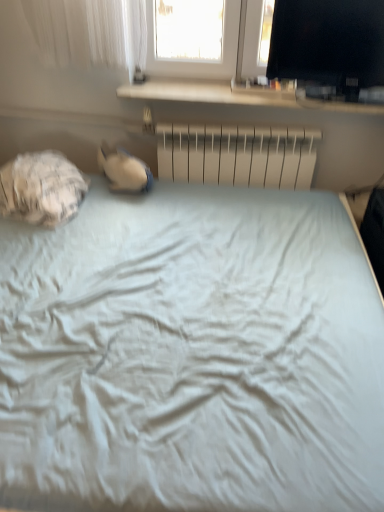
Question: Is black glossy monitor at upper right at the back of white textured sleeping bag at left?

Choices:
 (A) yes
 (B) no

Answer: (B)

Question: Does white textured sleeping bag at left have a greater height compared to black glossy monitor at upper right?

Choices:
 (A) yes
 (B) no

Answer: (B)

Question: From the image's perspective, is white textured sleeping bag at left beneath black glossy monitor at upper right?

Choices:
 (A) yes
 (B) no

Answer: (A)

Question: Does white textured sleeping bag at left have a smaller size compared to black glossy monitor at upper right?

Choices:
 (A) yes
 (B) no

Answer: (B)

Question: Is white textured sleeping bag at left to the right of black glossy monitor at upper right from the viewer's perspective?

Choices:
 (A) yes
 (B) no

Answer: (B)

Question: From the image's perspective, is white textured sleeping bag at left over black glossy monitor at upper right?

Choices:
 (A) yes
 (B) no

Answer: (B)

Question: Is metallic silver radiator at center aimed at black glossy monitor at upper right?

Choices:
 (A) yes
 (B) no

Answer: (B)

Question: From a real-world perspective, is metallic silver radiator at center on black glossy monitor at upper right?

Choices:
 (A) no
 (B) yes

Answer: (A)

Question: From the image's perspective, is metallic silver radiator at center above black glossy monitor at upper right?

Choices:
 (A) no
 (B) yes

Answer: (A)

Question: Is metallic silver radiator at center thinner than black glossy monitor at upper right?

Choices:
 (A) no
 (B) yes

Answer: (B)

Question: Can you confirm if metallic silver radiator at center is wider than black glossy monitor at upper right?

Choices:
 (A) yes
 (B) no

Answer: (B)

Question: Is the depth of metallic silver radiator at center greater than that of black glossy monitor at upper right?

Choices:
 (A) no
 (B) yes

Answer: (B)

Question: Can you confirm if black glossy monitor at upper right is positioned to the right of white textured sleeping bag at left?

Choices:
 (A) yes
 (B) no

Answer: (A)